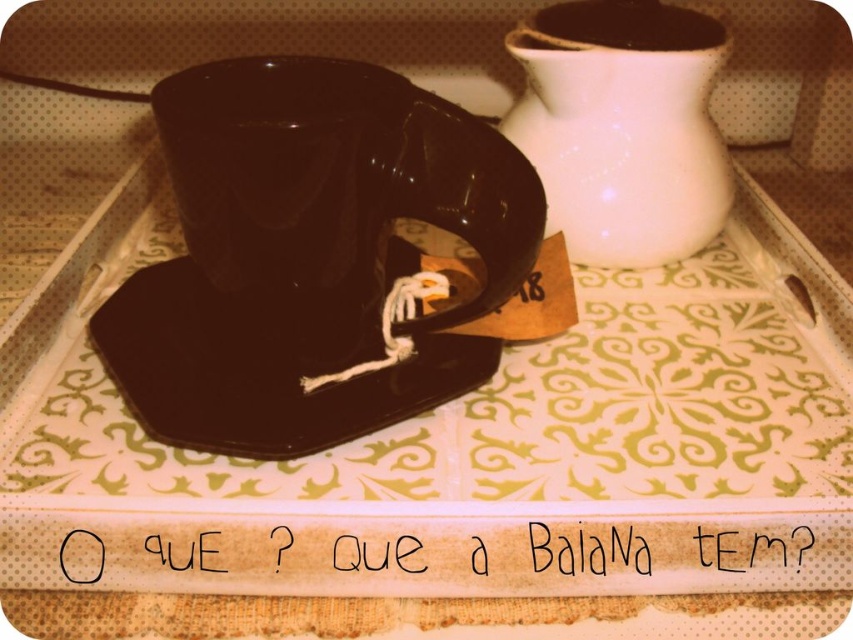
Question: Is the position of white glossy jug at upper right less distant than that of glossy ceramic coffee cup at upper center?

Choices:
 (A) yes
 (B) no

Answer: (A)

Question: Which of the following is the closest to the observer?

Choices:
 (A) (142, 275)
 (B) (326, 189)

Answer: (B)

Question: Which is farther from the glossy ceramic saucer at center?

Choices:
 (A) glossy ceramic coffee cup at upper center
 (B) white glossy jug at upper right
 (C) glossy ceramic mug at upper center

Answer: (A)

Question: Does white glossy jug at upper right appear over glossy ceramic coffee cup at upper center?

Choices:
 (A) yes
 (B) no

Answer: (B)

Question: Which object appears farthest from the camera in this image?

Choices:
 (A) glossy ceramic saucer at center
 (B) glossy ceramic mug at upper center
 (C) white glossy jug at upper right

Answer: (C)

Question: Does glossy ceramic mug at upper center come behind glossy ceramic coffee cup at upper center?

Choices:
 (A) no
 (B) yes

Answer: (A)